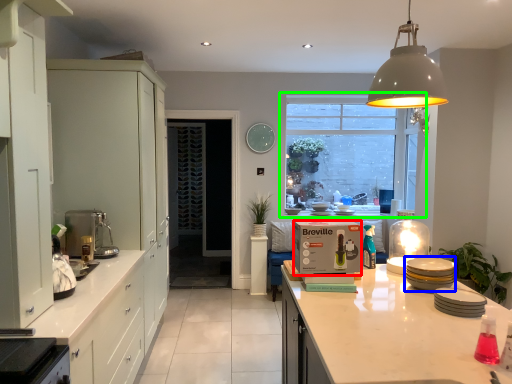
Question: Which object is the closest to the cardboard box (highlighted by a red box)? Choose among these: appliance (highlighted by a blue box) or window (highlighted by a green box).

Choices:
 (A) appliance
 (B) window

Answer: (A)